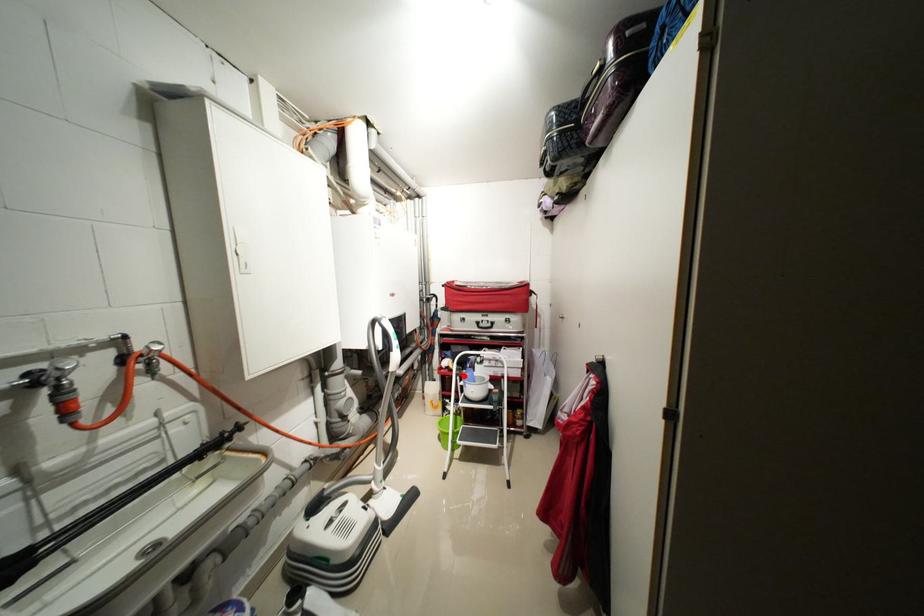
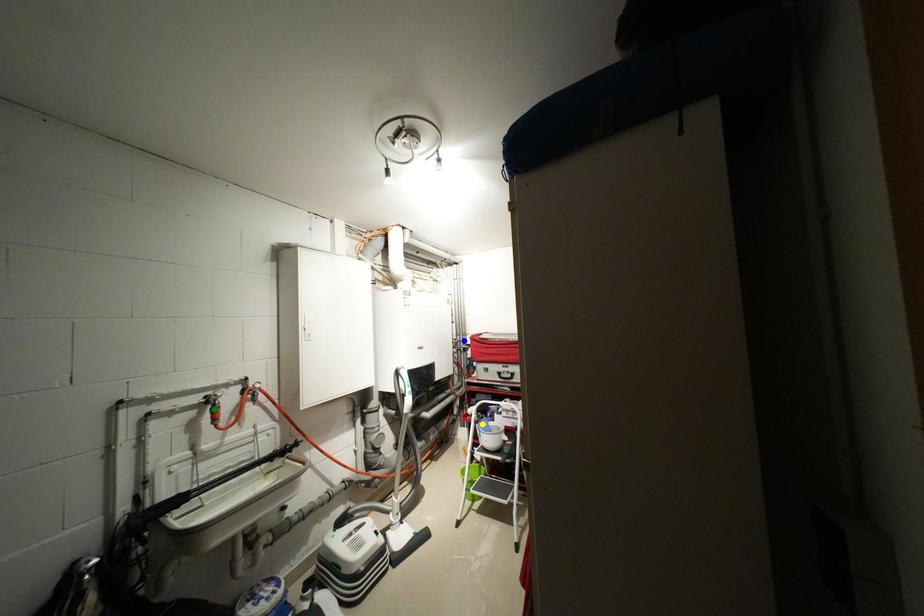
Question: I am providing you with two images of the same scene from different viewpoints. A red point is marked on the first image. You are given multiple points on the second image. Which point in image 2 is actually the same real-world point as the red point in image 1?

Choices:
 (A) yellow point
 (B) green point
 (C) blue point

Answer: (A)